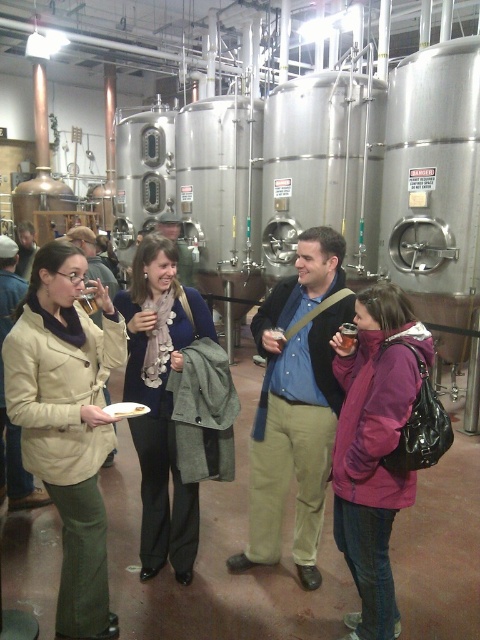
Question: Among these objects, which one is farthest from the camera?

Choices:
 (A) matte blue scarf at center
 (B) purple fleece jacket at center

Answer: (A)

Question: Which point appears closest to the camera in this image?

Choices:
 (A) (360, 316)
 (B) (184, 557)
 (C) (55, 419)

Answer: (C)

Question: Is matte beige coat at left below matte blue scarf at center?

Choices:
 (A) yes
 (B) no

Answer: (A)

Question: Among these objects, which one is farthest from the camera?

Choices:
 (A) matte beige coat at left
 (B) purple fleece jacket at center

Answer: (A)

Question: Is the position of matte beige coat at left more distant than that of purple fleece jacket at center?

Choices:
 (A) no
 (B) yes

Answer: (B)

Question: Does matte blue scarf at center appear on the right side of purple fleece jacket at center?

Choices:
 (A) yes
 (B) no

Answer: (B)